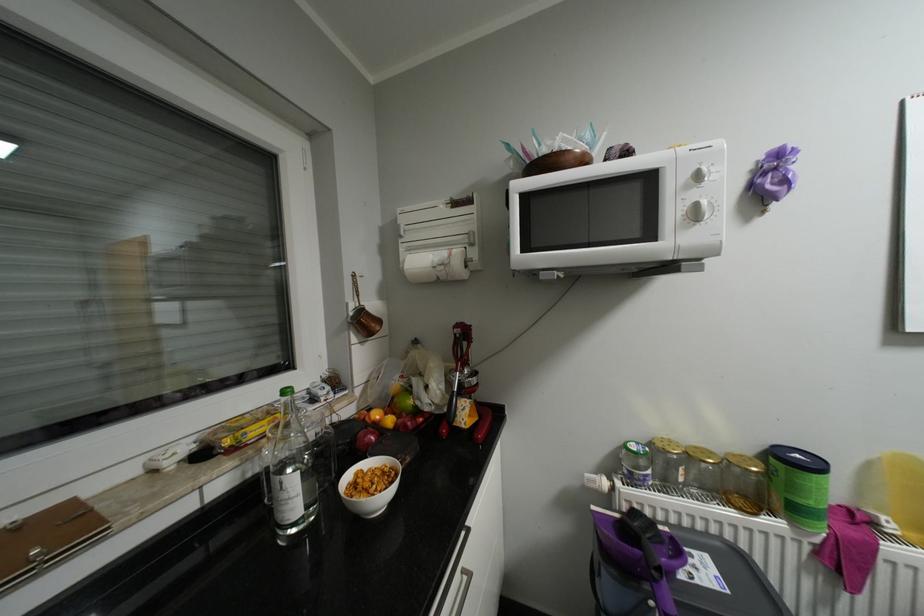
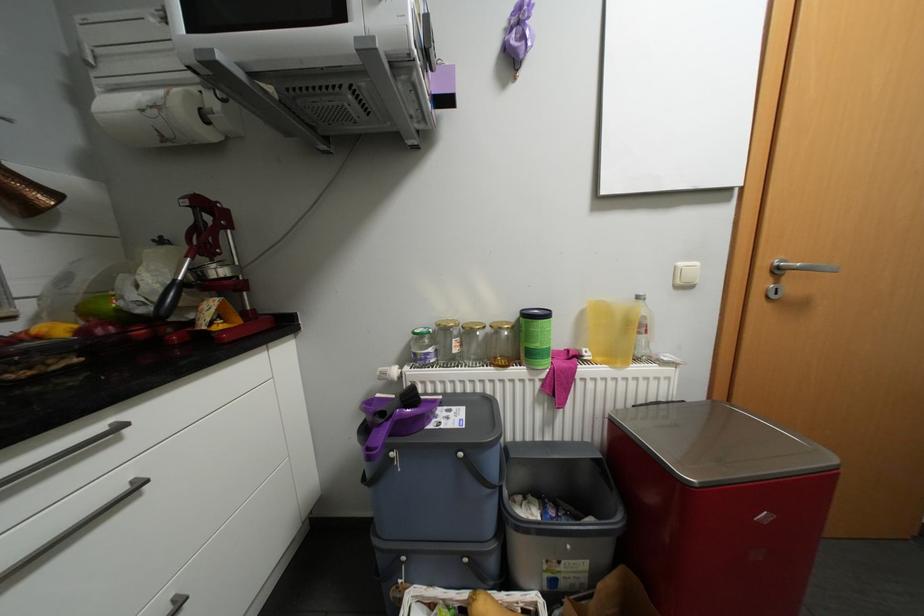
Question: Based on the continuous images, in which direction is the camera rotating? Reply with the corresponding letter.

Choices:
 (A) Left
 (B) Right
 (C) Up
 (D) Down

Answer: (B)